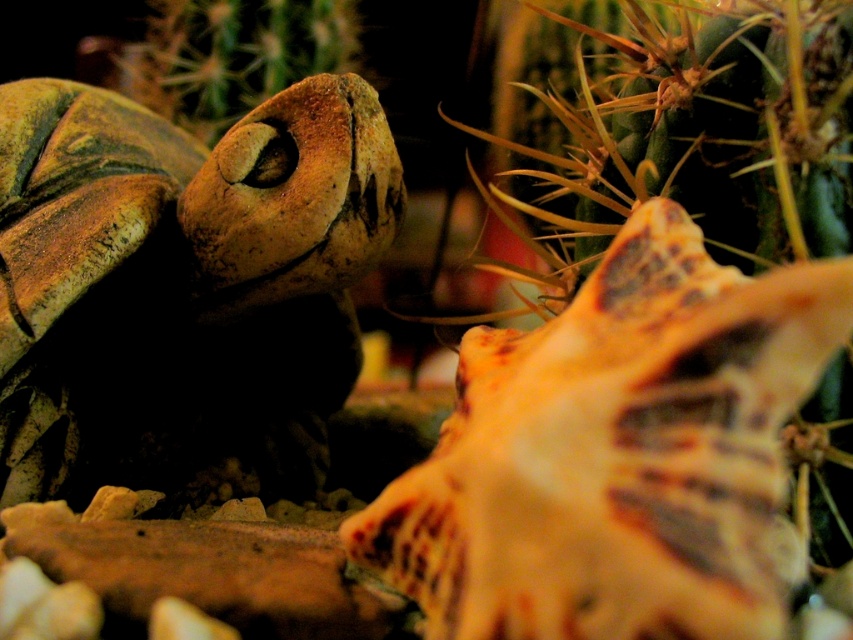
Question: Does matte brown tortoise at center appear on the left side of brown textured cactus at upper left?

Choices:
 (A) yes
 (B) no

Answer: (B)

Question: Which of the following is the farthest from the observer?

Choices:
 (A) (350, 140)
 (B) (279, 33)

Answer: (B)

Question: Where is matte brown tortoise at center located in relation to brown textured cactus at upper left in the image?

Choices:
 (A) right
 (B) left

Answer: (A)

Question: Which object appears closest to the camera in this image?

Choices:
 (A) matte brown tortoise at center
 (B) brown textured cactus at upper left

Answer: (A)

Question: Observing the image, what is the correct spatial positioning of matte brown tortoise at center in reference to brown textured cactus at upper left?

Choices:
 (A) below
 (B) above

Answer: (A)